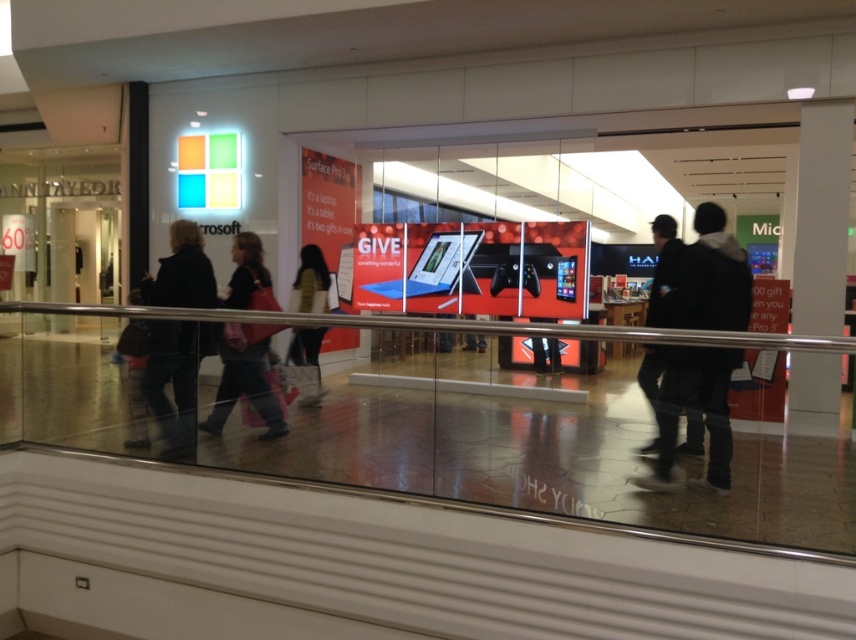
You are a delivery person who needs to place two jackets in a storage box. The box is 3.5 feet wide. You have the matte black jacket at center and the dark gray jacket at center. Can both jackets fit side by side in the box?

The distance between the matte black jacket at center and dark gray jacket at center is 3.67 feet. Since the box is only 3.5 feet wide, the two jackets cannot fit side by side in the box.

You are a customer in the Microsoft store looking to buy a jacket. You see the black fabric jacket at lower right and the matte black jacket at center. Which one is smaller in size?

The black fabric jacket at lower right is smaller in size compared to the matte black jacket at center.